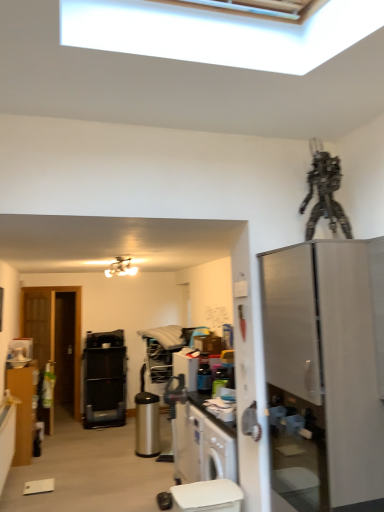
Question: Is matte brown cabinet at left further to the viewer compared to metallic robot at upper right?

Choices:
 (A) yes
 (B) no

Answer: (A)

Question: Is matte brown cabinet at left not within metallic robot at upper right?

Choices:
 (A) no
 (B) yes

Answer: (B)

Question: From a real-world perspective, is matte brown cabinet at left on top of metallic robot at upper right?

Choices:
 (A) no
 (B) yes

Answer: (A)

Question: Considering the relative sizes of matte brown cabinet at left and metallic robot at upper right in the image provided, is matte brown cabinet at left taller than metallic robot at upper right?

Choices:
 (A) yes
 (B) no

Answer: (A)

Question: Does matte brown cabinet at left have a lesser height compared to metallic robot at upper right?

Choices:
 (A) yes
 (B) no

Answer: (B)

Question: Considering the positions of matte brown cabinet at left and polished stainless steel trash can at center, which ranks as the 2th appliance in left-to-right order, in the image, is matte brown cabinet at left wider or thinner than polished stainless steel trash can at center, which ranks as the 2th appliance in left-to-right order,?

Choices:
 (A) wide
 (B) thin

Answer: (B)

Question: From the image's perspective, is matte brown cabinet at left positioned above or below polished stainless steel trash can at center, which is counted as the 2th appliance, starting from the front?

Choices:
 (A) below
 (B) above

Answer: (B)

Question: Is point (26, 394) positioned closer to the camera than point (150, 410)?

Choices:
 (A) closer
 (B) farther

Answer: (A)

Question: Relative to polished stainless steel trash can at center, which ranks as the 2th appliance in left-to-right order, is matte brown cabinet at left in front or behind?

Choices:
 (A) behind
 (B) front

Answer: (B)

Question: From a real-world perspective, is metallic silver toaster at center, placed as the 1th appliance when sorted from front to back, above or below polished stainless steel trash can at center, which is counted as the 2th appliance, starting from the front?

Choices:
 (A) below
 (B) above

Answer: (B)

Question: Is metallic silver toaster at center, which is counted as the 3th appliance, starting from the back, inside or outside of polished stainless steel trash can at center, the 2th appliance viewed from the back?

Choices:
 (A) inside
 (B) outside

Answer: (B)

Question: Is point (210, 389) positioned closer to the camera than point (145, 417)?

Choices:
 (A) closer
 (B) farther

Answer: (A)

Question: In terms of height, does metallic silver toaster at center, marked as the 1th appliance in a right-to-left arrangement, look taller or shorter compared to polished stainless steel trash can at center, the 2th appliance viewed from the back?

Choices:
 (A) short
 (B) tall

Answer: (A)

Question: Is transparent glass door at left wider or thinner than matte brown cabinet at left?

Choices:
 (A) wide
 (B) thin

Answer: (B)

Question: Considering the positions of point (52, 324) and point (18, 391), is point (52, 324) closer or farther from the camera than point (18, 391)?

Choices:
 (A) closer
 (B) farther

Answer: (B)